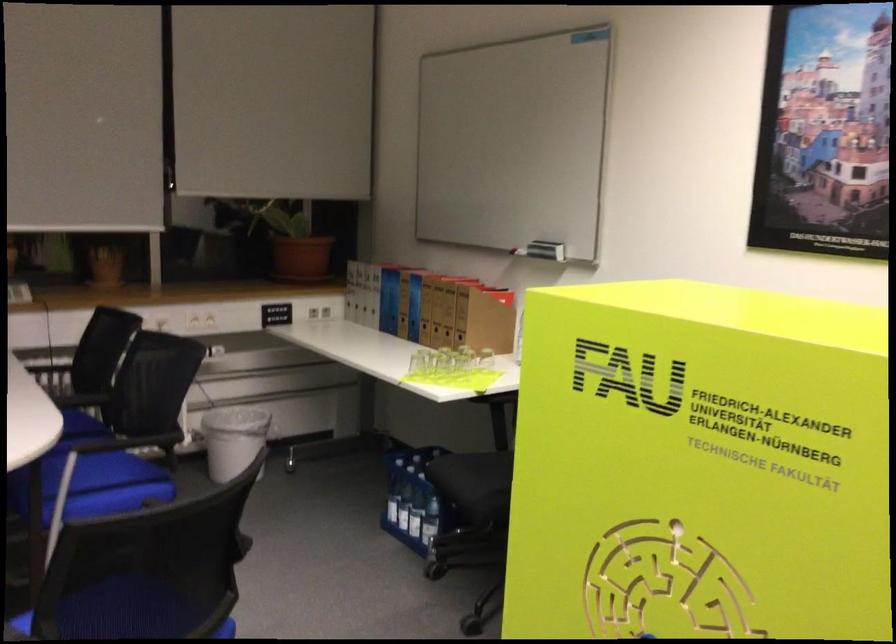
The width and height of the screenshot is (896, 644). What do you see at coordinates (382, 321) in the screenshot?
I see `the blue binder spine hole` at bounding box center [382, 321].